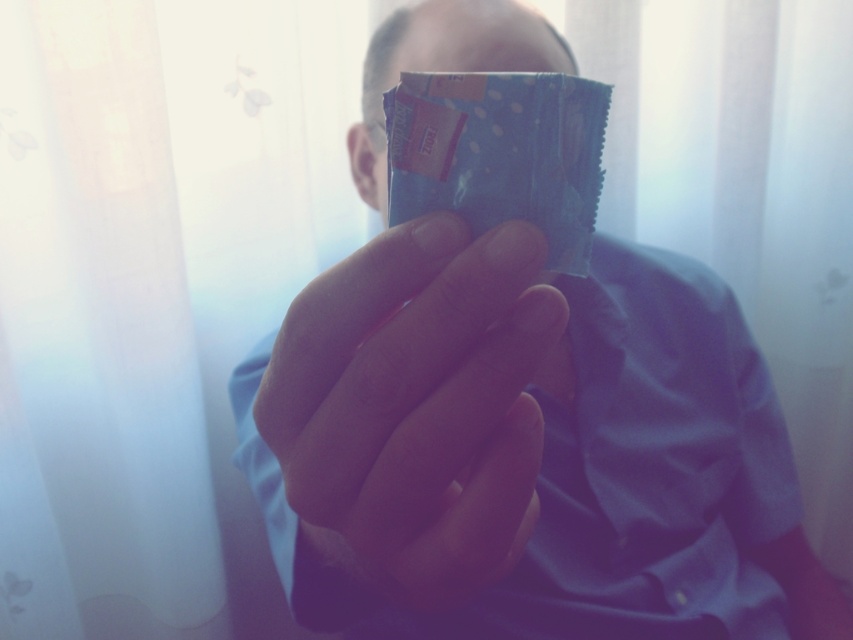
How far apart are matte plastic packet at center and matte plastic hand at center?

8.60 inches

Who is taller, matte plastic packet at center or matte plastic hand at center?

matte plastic packet at center is taller.

You are a GUI agent. You are given a task and a screenshot of the screen. Output one action in this format:
    pyautogui.click(x=<x>, y=<y>)
    Task: Click on the matte plastic packet at center
    
    Given the screenshot: What is the action you would take?
    pyautogui.click(x=526, y=449)

This screenshot has width=853, height=640. Identify the location of matte plastic packet at center. coord(526,449).

Which is more to the left, matte plastic hand at center or blue matte chocolate bar at center?

matte plastic hand at center

Does matte plastic hand at center appear on the right side of blue matte chocolate bar at center?

Incorrect, matte plastic hand at center is not on the right side of blue matte chocolate bar at center.

Locate an element on the screen. Image resolution: width=853 pixels, height=640 pixels. matte plastic hand at center is located at coordinates (416, 406).

This screenshot has width=853, height=640. What do you see at coordinates (526, 449) in the screenshot?
I see `matte plastic packet at center` at bounding box center [526, 449].

Between matte plastic packet at center and blue matte chocolate bar at center, which one has more height?

Standing taller between the two is matte plastic packet at center.

Who is more distant from viewer, (x=352, y=465) or (x=422, y=113)?

Point (x=422, y=113)

At what (x,y) coordinates should I click in order to perform the action: click on matte plastic packet at center. Please return your answer as a coordinate pair (x, y). This screenshot has height=640, width=853. Looking at the image, I should click on (526, 449).